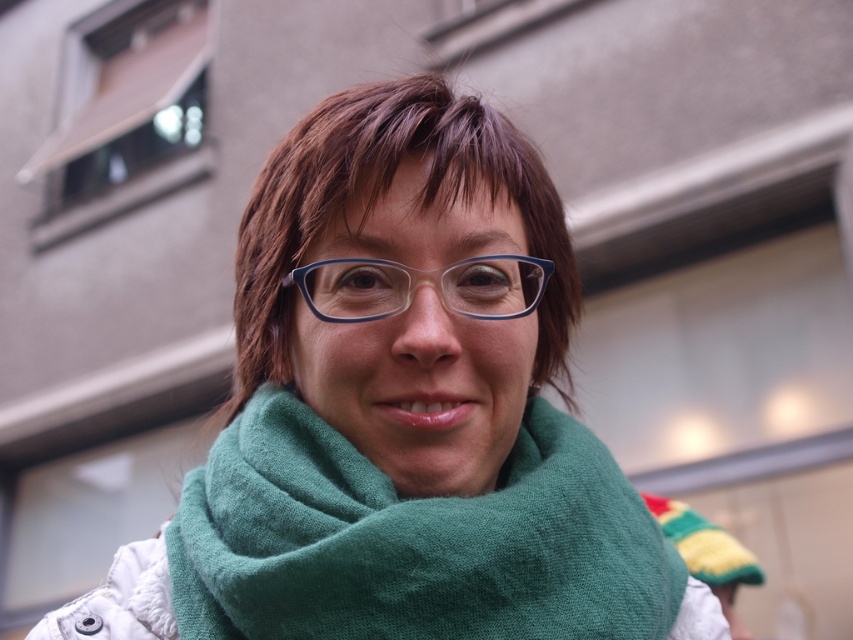
Is green woolen scarf at center taller than transparent blue glasses at center?

Correct, green woolen scarf at center is much taller as transparent blue glasses at center.

Does green woolen scarf at center appear under transparent blue glasses at center?

Indeed, green woolen scarf at center is positioned under transparent blue glasses at center.

Is point (473, 563) positioned before point (529, 291)?

Yes, it is in front of point (529, 291).

You are a GUI agent. You are given a task and a screenshot of the screen. Output one action in this format:
    pyautogui.click(x=<x>, y=<y>)
    Task: Click on the green woolen scarf at center
    Image resolution: width=853 pixels, height=640 pixels.
    Given the screenshot: What is the action you would take?
    pyautogui.click(x=412, y=540)